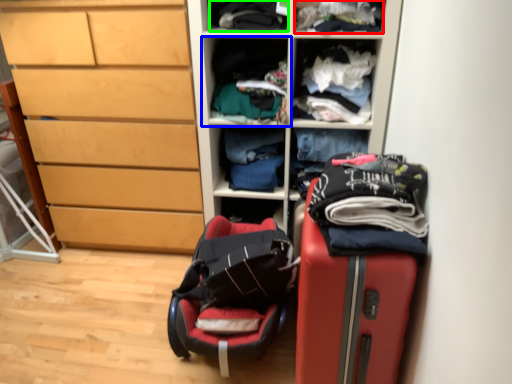
Question: Which is nearer to the clothing (highlighted by a red box)? shelf (highlighted by a blue box) or clothing (highlighted by a green box).

Choices:
 (A) shelf
 (B) clothing

Answer: (B)